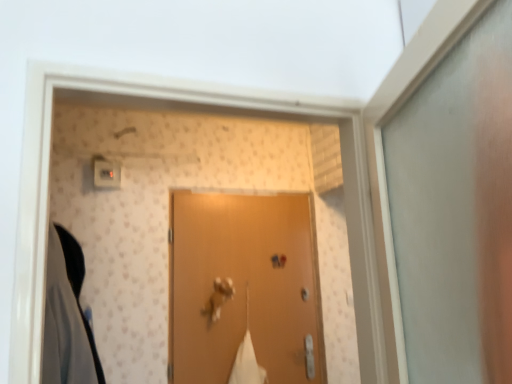
Question: In the image, is matte brown door at center on the left side or the right side of metallic gold door handle at center?

Choices:
 (A) right
 (B) left

Answer: (A)

Question: Based on their sizes in the image, would you say matte brown door at center is bigger or smaller than metallic gold door handle at center?

Choices:
 (A) big
 (B) small

Answer: (A)

Question: Which object is the closest to the matte plastic light switch at upper left?

Choices:
 (A) matte brown door at center
 (B) metallic gold door handle at center
 (C) dark gray fabric at left

Answer: (C)

Question: Considering the real-world distances, which object is closest to the metallic gold door handle at center?

Choices:
 (A) matte brown door at center
 (B) dark gray fabric at left
 (C) matte plastic light switch at upper left

Answer: (A)